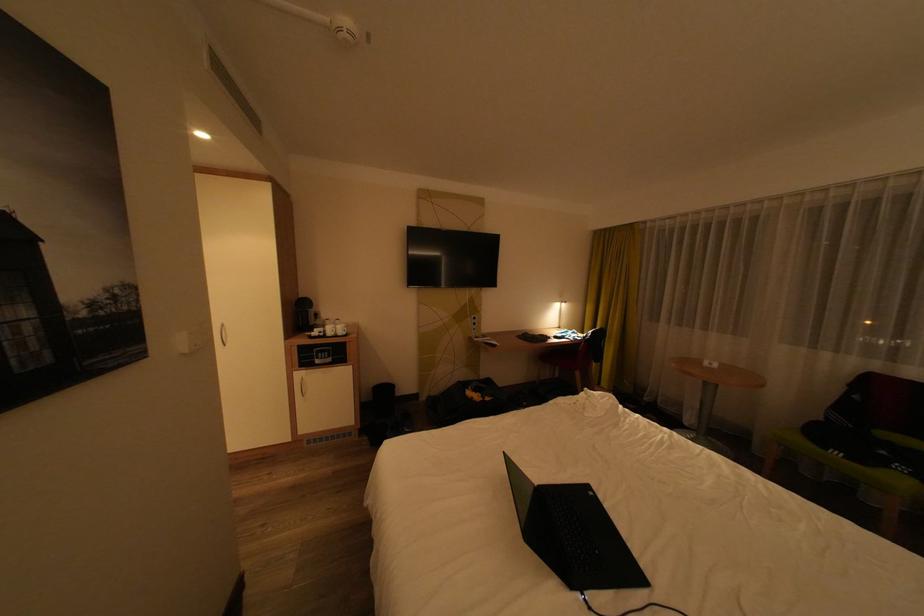
The height and width of the screenshot is (616, 924). In order to click on recessed cabinet handle in this screenshot , I will do `click(302, 386)`.